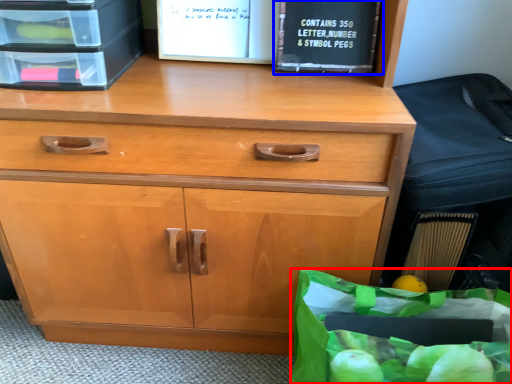
Question: Which object appears farthest to the camera in this image, grocery bag (highlighted by a red box) or paperback book (highlighted by a blue box)?

Choices:
 (A) grocery bag
 (B) paperback book

Answer: (B)